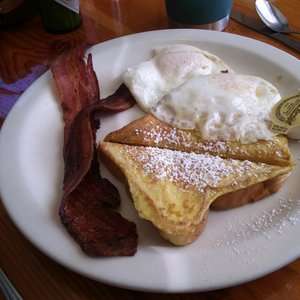
The width and height of the screenshot is (300, 300). I want to click on green bottle, so click(x=69, y=22).